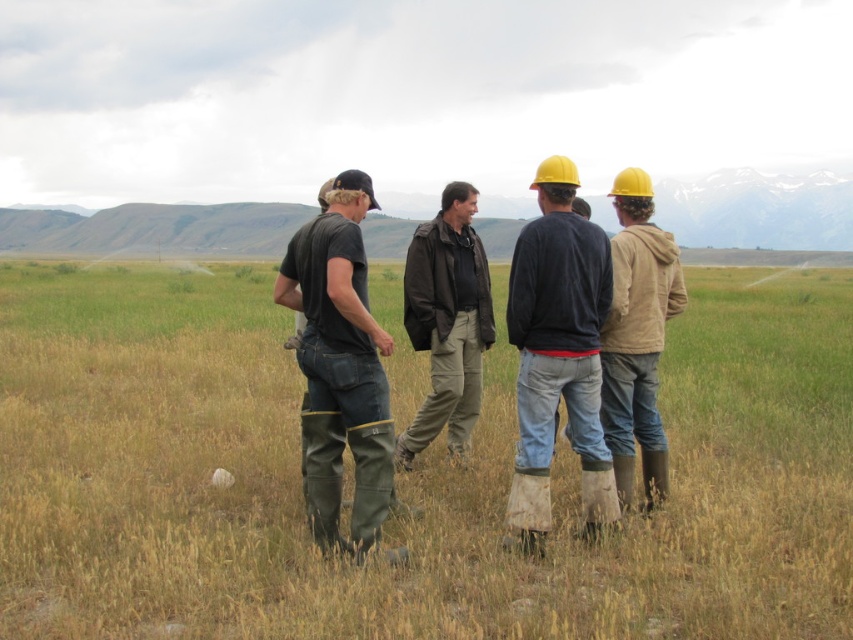
Question: Which of the following is the closest to the observer?

Choices:
 (A) green grassy at center
 (B) dark brown leather jacket at center
 (C) matte black jacket at center
 (D) tan fabric jacket at right

Answer: (A)

Question: Does green grassy at center appear on the left side of dark brown leather jacket at center?

Choices:
 (A) yes
 (B) no

Answer: (B)

Question: Which is nearer to the dark green rubber boots at center?

Choices:
 (A) dark brown leather jacket at center
 (B) tan fabric jacket at right
 (C) green grassy at center
 (D) matte black jacket at center

Answer: (D)

Question: Which point is farther from the camera taking this photo?

Choices:
 (A) (570, 241)
 (B) (622, 355)
 (C) (370, 320)

Answer: (B)

Question: Is dark green rubber boots at center to the left of tan fabric jacket at right from the viewer's perspective?

Choices:
 (A) yes
 (B) no

Answer: (A)

Question: Can you confirm if tan fabric jacket at right is smaller than dark brown leather jacket at center?

Choices:
 (A) no
 (B) yes

Answer: (B)